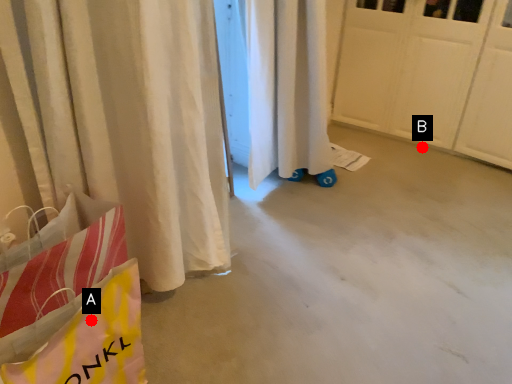
Question: Two points are circled on the image, labeled by A and B beside each circle. Which point is closer to the camera?

Choices:
 (A) A is closer
 (B) B is closer

Answer: (A)